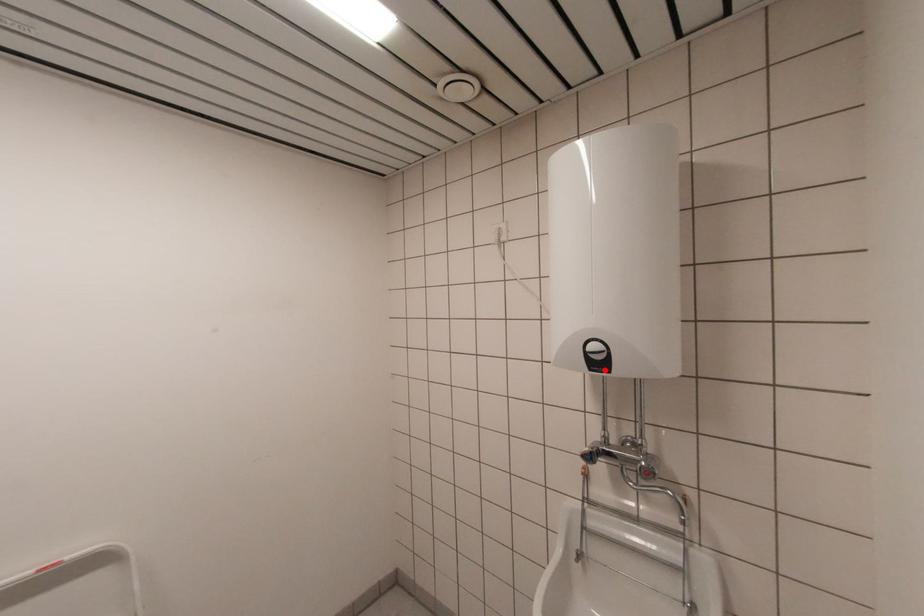
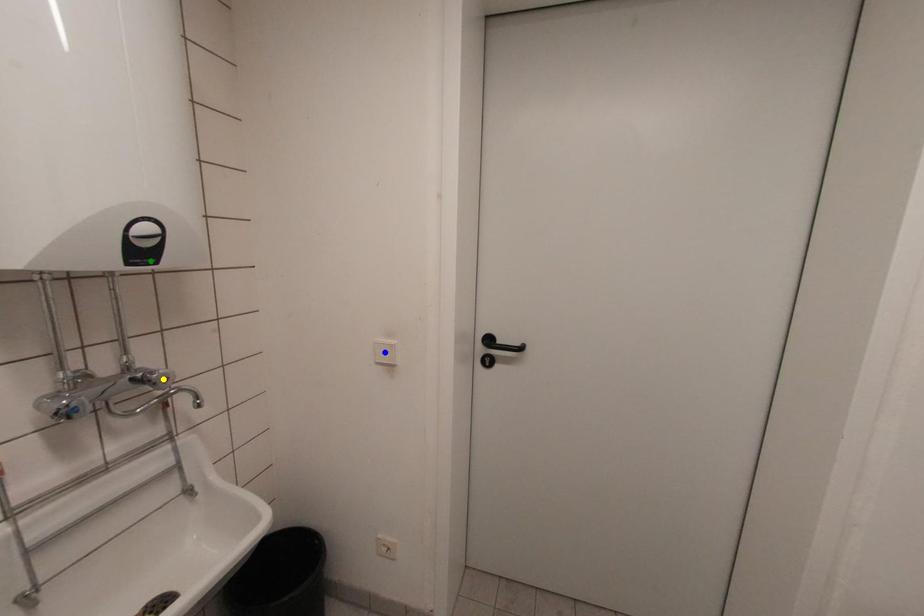
Question: I am providing you with two images of the same scene from different viewpoints. A red point is marked on the first image. You are given multiple points on the second image. Which point in image 2 is actually the same real-world point as the red point in image 1?

Choices:
 (A) blue point
 (B) yellow point
 (C) green point

Answer: (C)